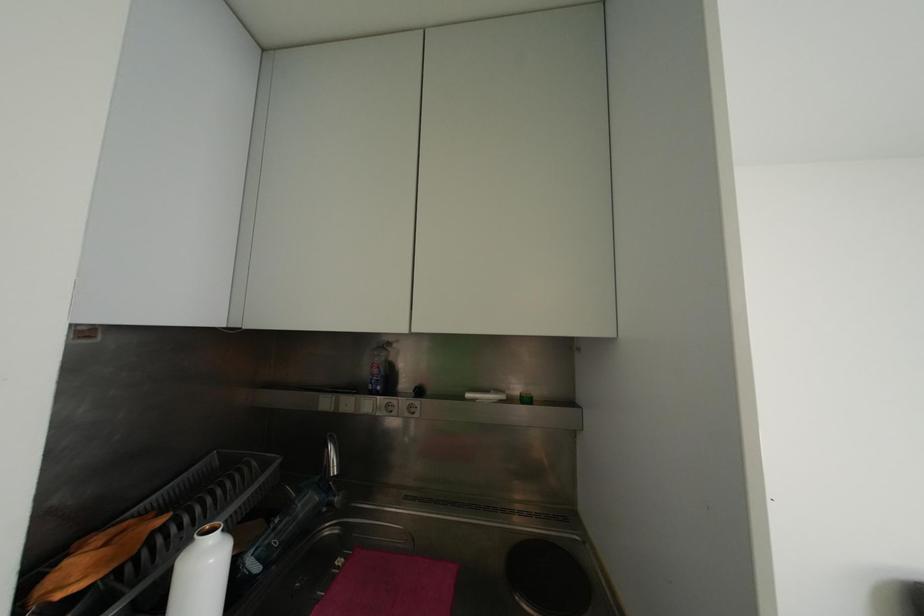
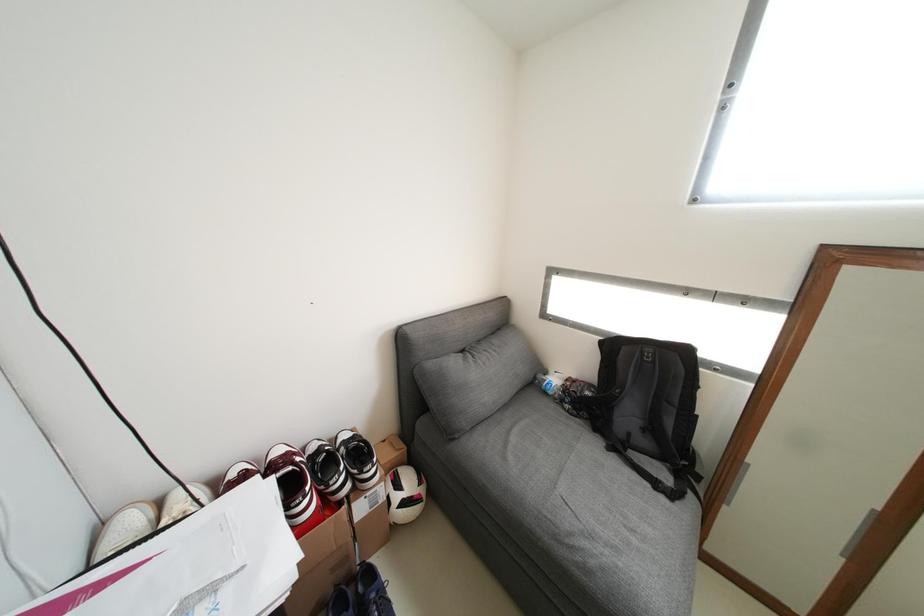
Based on the continuous images, in which direction is the camera rotating?

The camera rotated toward right-down.